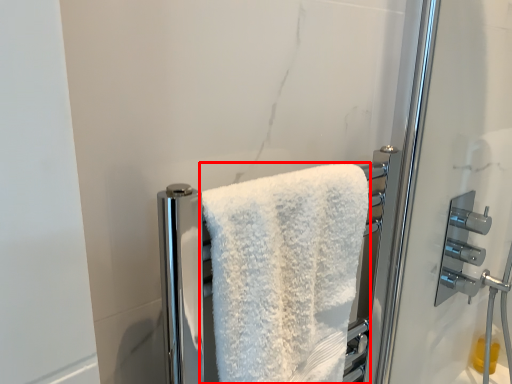
Question: From the image's perspective, considering the relative positions of towel (annotated by the red box) and door handle in the image provided, where is towel (annotated by the red box) located with respect to the staircase?

Choices:
 (A) below
 (B) above

Answer: (A)